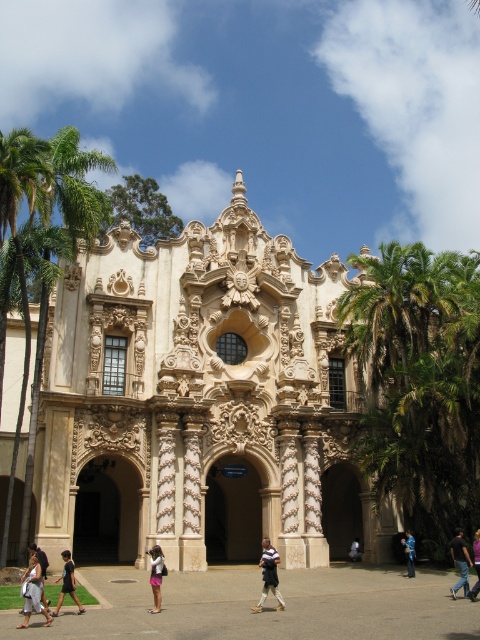
Question: Which object is closer to the camera taking this photo?

Choices:
 (A) blue denim jeans at center
 (B) white fabric pants at lower right

Answer: (A)

Question: Which point appears farthest from the camera in this image?

Choices:
 (A) (62, 584)
 (B) (35, 579)
 (C) (468, 561)

Answer: (C)

Question: Which object is farther from the camera taking this photo?

Choices:
 (A) dark gray fabric skirt at lower left
 (B) light brown leather bag at lower left
 (C) denim shorts at lower right

Answer: (C)

Question: Does white cotton dress at lower left lie in front of blue denim jeans at center?

Choices:
 (A) no
 (B) yes

Answer: (B)

Question: In this image, where is light brown leather jacket at center located relative to white fabric pants at lower right?

Choices:
 (A) above
 (B) below

Answer: (A)

Question: Is dark gray fabric skirt at lower left further to camera compared to white fabric pants at lower right?

Choices:
 (A) yes
 (B) no

Answer: (B)